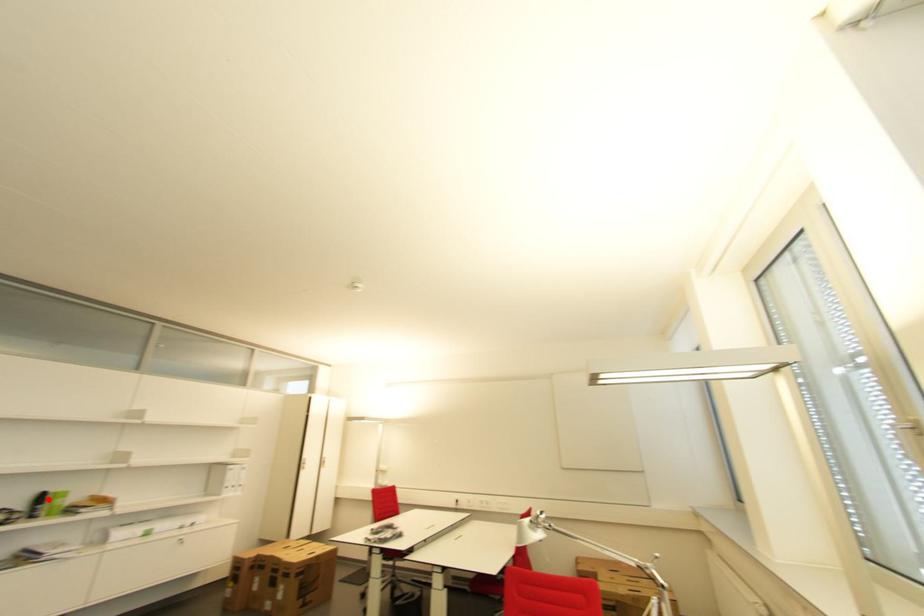
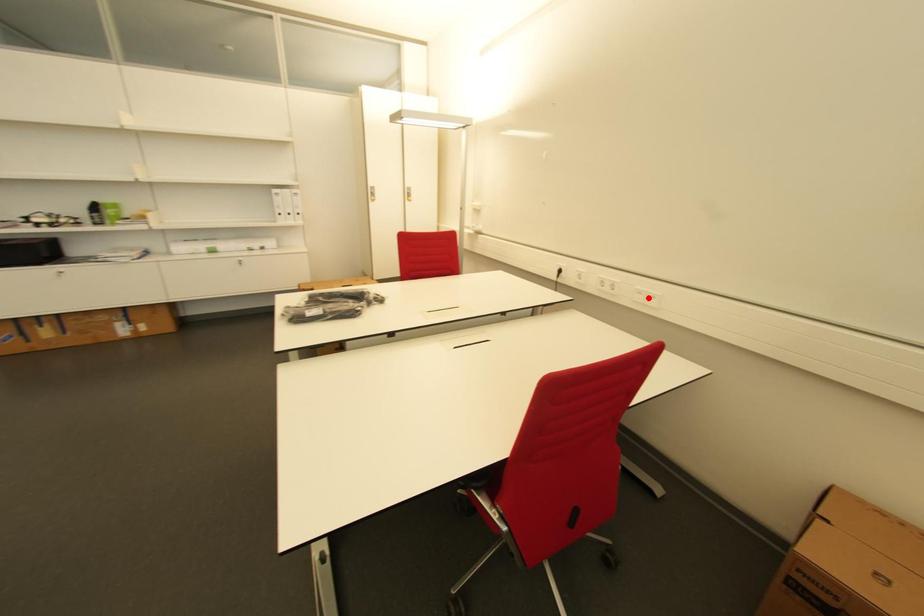
I am providing you with two images of the same scene from different viewpoints. A red point is marked on the first image and another point is marked on the second image. Do the highlighted points in image1 and image2 indicate the same real-world spot?

No